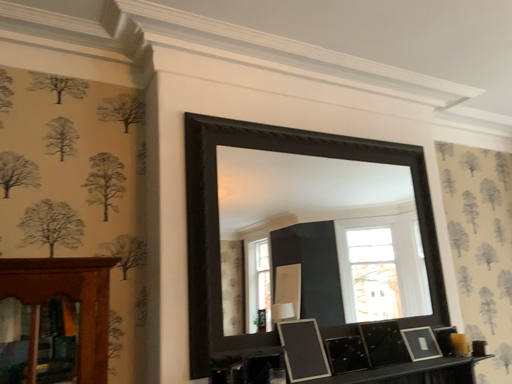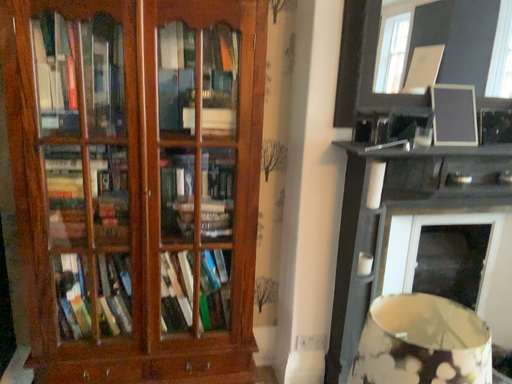
Question: How did the camera likely rotate when shooting the video?

Choices:
 (A) rotated right
 (B) rotated left

Answer: (B)